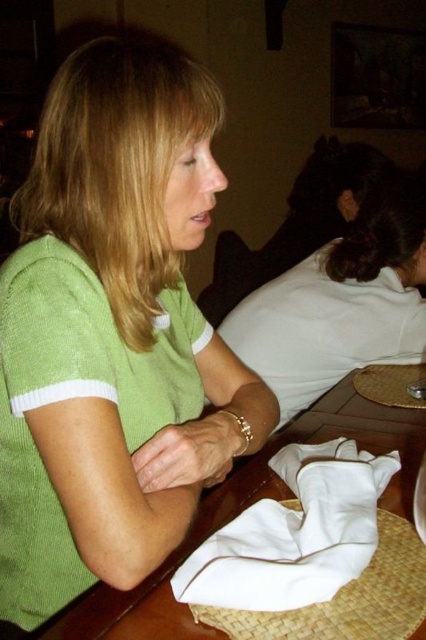
You are a fashion designer observing the woman in the image. You need to determine if her green matte shirt at center can be folded and placed inside the white cotton napkin at lower center. Based on their sizes, what do you think?

The green matte shirt at center is bigger than the white cotton napkin at lower center, so it cannot be folded and placed inside the napkin.

You are a tailor measuring the distance between two green garments in a photo. The garments are the green knitted sweater at center and the green matte shirt at center. The tailor needs to know if the distance between them is more than 24 inches to decide if they can be placed side by side on a 25 inch wide shelf. Can they fit?

The green knitted sweater at center and green matte shirt at center are 25.26 inches apart. Since the shelf is 25 inches wide, the total width required for both garments would exceed the shelf capacity. Therefore, they cannot be placed side by side on the shelf.